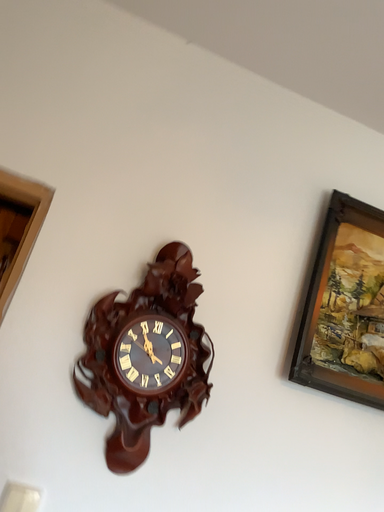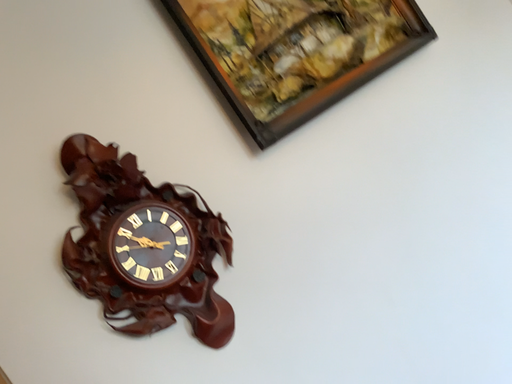
Question: Which way did the camera rotate in the video?

Choices:
 (A) rotated right
 (B) rotated left

Answer: (A)